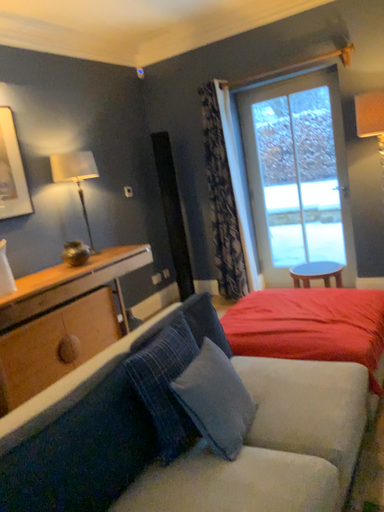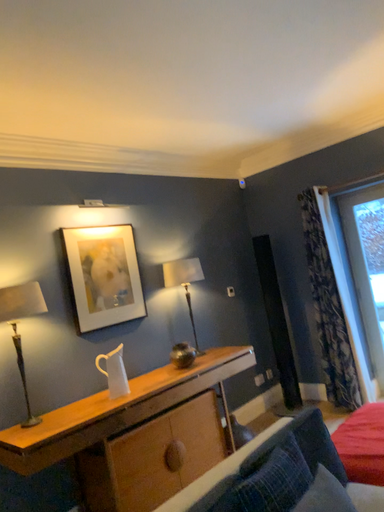
Question: Which way did the camera rotate in the video?

Choices:
 (A) rotated upward
 (B) rotated downward

Answer: (A)